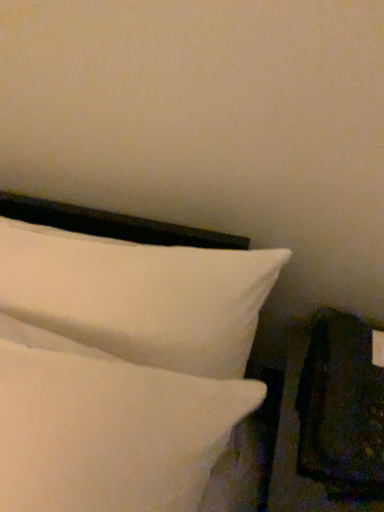
Where is `white soft pillows at upper left`? The width and height of the screenshot is (384, 512). white soft pillows at upper left is located at coordinates (121, 368).

What do you see at coordinates (121, 368) in the screenshot? The width and height of the screenshot is (384, 512). I see `white soft pillows at upper left` at bounding box center [121, 368].

In order to face white soft pillows at upper left, should I rotate leftwards or rightwards?

It's best to rotate left around 18.460 degrees.

The width and height of the screenshot is (384, 512). I want to click on white soft pillows at upper left, so click(x=121, y=368).